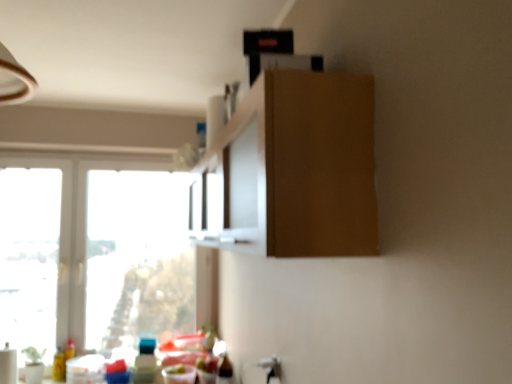
Question: Is translucent plastic bottle at lower left to the left or to the right of white glossy window at lower left in the image?

Choices:
 (A) left
 (B) right

Answer: (B)

Question: From a real-world perspective, relative to white glossy window at lower left, is translucent plastic bottle at lower left vertically above or below?

Choices:
 (A) above
 (B) below

Answer: (B)

Question: Which object is positioned closest to the matte wood cabinet at upper center?

Choices:
 (A) white glossy window at lower left
 (B) translucent plastic bottle at lower left

Answer: (B)

Question: Estimate the real-world distances between objects in this image. Which object is closer to the matte wood cabinet at upper center?

Choices:
 (A) white glossy window at lower left
 (B) translucent plastic bottle at lower left

Answer: (B)